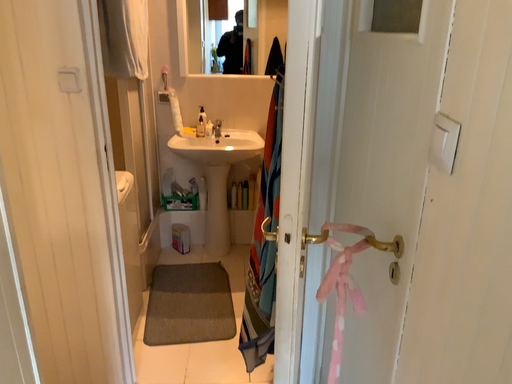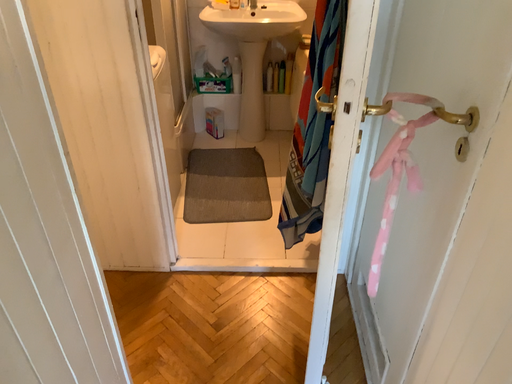
Question: Which way did the camera rotate in the video?

Choices:
 (A) rotated downward
 (B) rotated upward

Answer: (A)